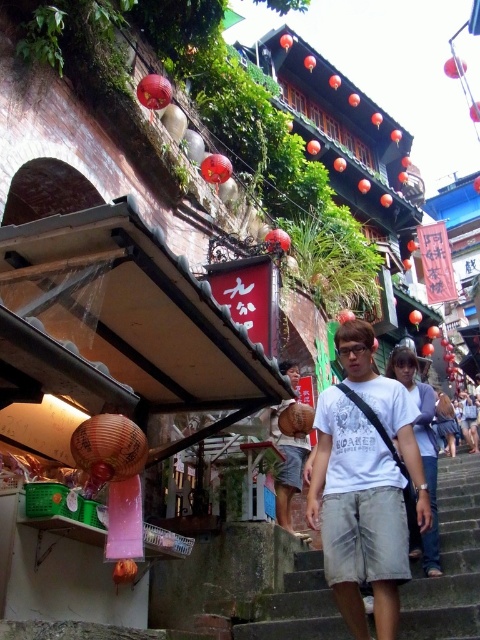
You are standing at the bottom of the stone steps and want to walk towards the building with red lanterns. There are two points marked on the path. Which point should you aim for first, point [415,404] or point [285,468]?

You should aim for point [415,404] first because it is in front of point [285,468], meaning it is closer to your current position at the bottom of the stone steps.

You are standing at the bottom of the gray concrete stairs at center. Where exactly are you located in the image?

You are located at point (448, 561) on the image.